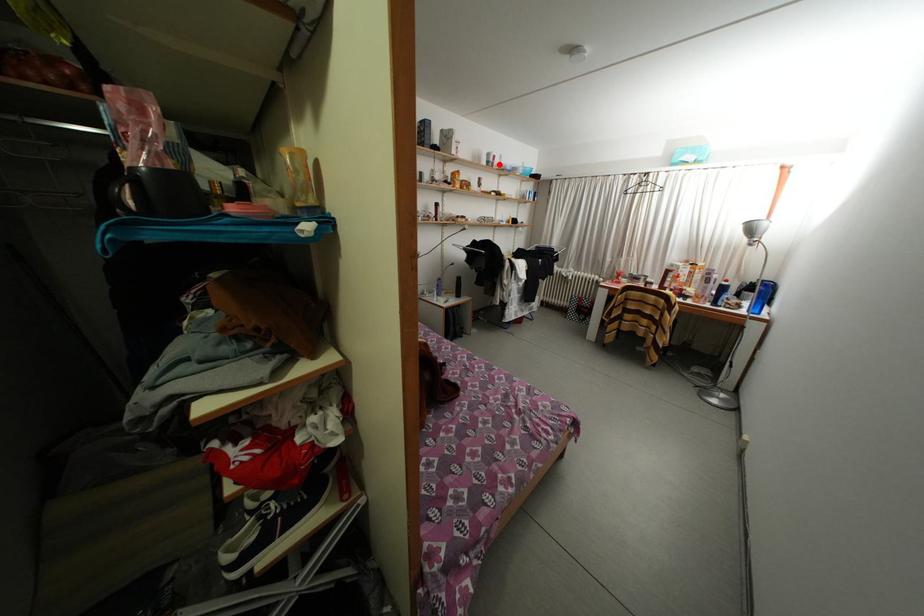
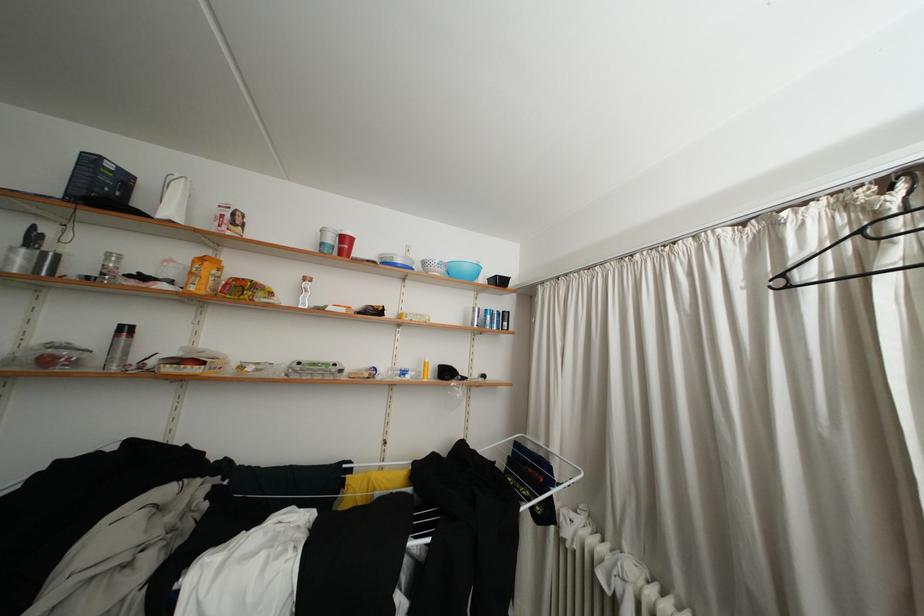
Question: A red point is marked in image1. In image2, is the corresponding 3D point closer to the camera or farther? Reply with the corresponding letter.

Choices:
 (A) The corresponding 3D point is closer.
 (B) The corresponding 3D point is farther.

Answer: (B)